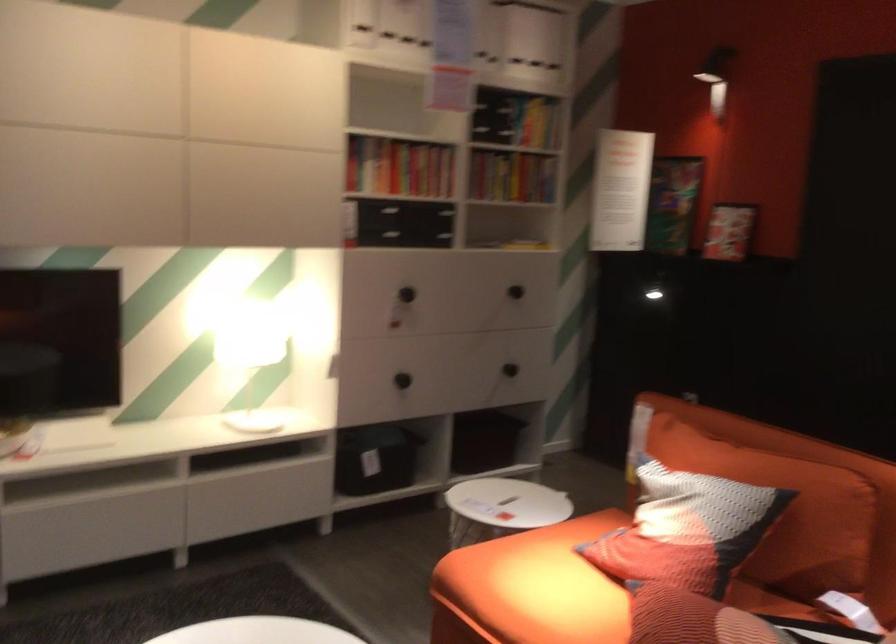
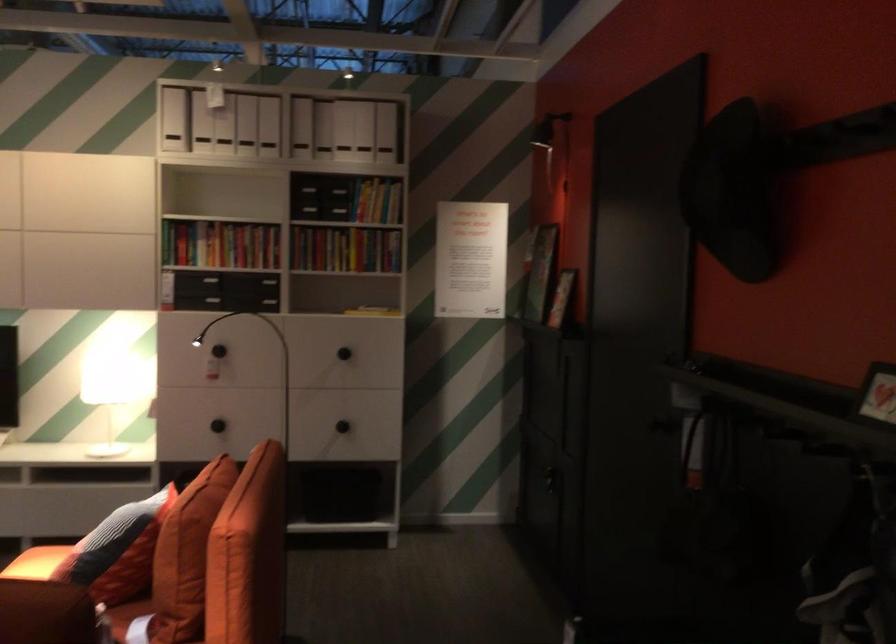
The point at (556,111) is marked in the first image. Where is the corresponding point in the second image?

(376, 201)